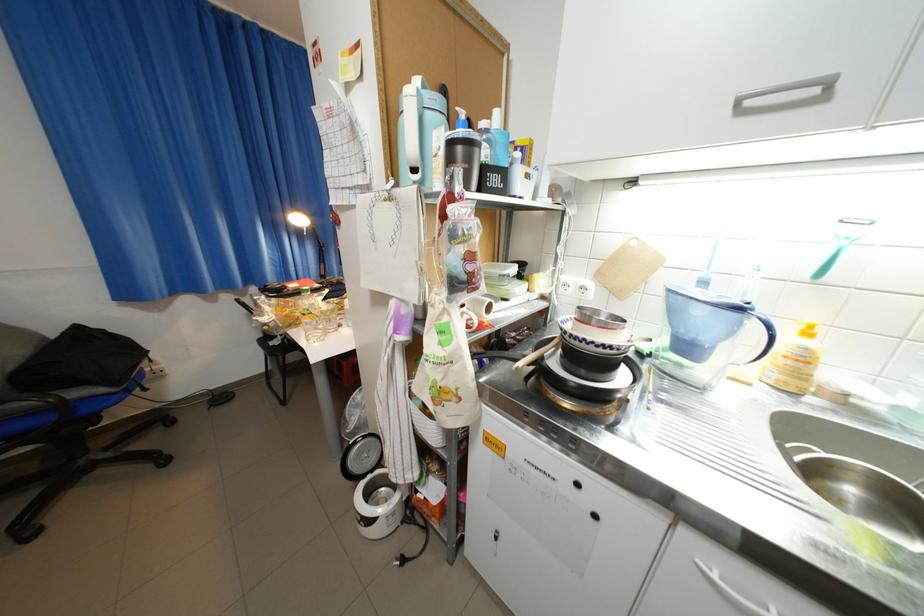
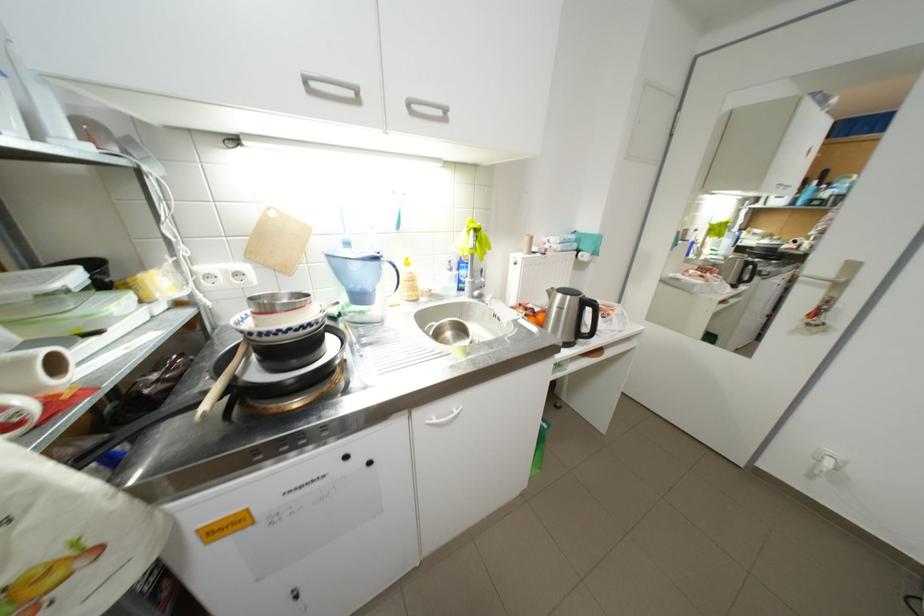
The point at [603,342] is marked in the first image. Where is the corresponding point in the second image?

(300, 330)